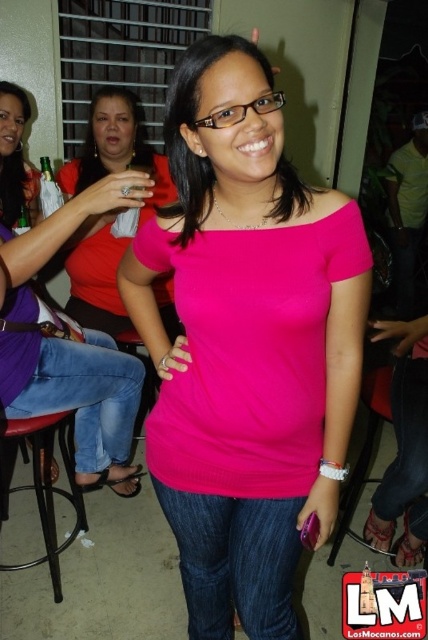
Question: Which point is closer to the camera?

Choices:
 (A) jeans at center
 (B) metallic black bar stool at lower left
 (C) jeans at left

Answer: (C)

Question: Estimate the real-world distances between objects in this image. Which object is farther from the jeans at left?

Choices:
 (A) denim jeans at center
 (B) matte red blouse at upper left
 (C) metallic black bar stool at lower left
 (D) jeans at center

Answer: (D)

Question: Does matte red blouse at upper left appear over jeans at left?

Choices:
 (A) no
 (B) yes

Answer: (B)

Question: Among these objects, which one is farthest from the camera?

Choices:
 (A) matte red blouse at upper left
 (B) denim jeans at center
 (C) jeans at left

Answer: (A)

Question: Can you confirm if denim jeans at center is wider than matte red blouse at upper left?

Choices:
 (A) no
 (B) yes

Answer: (A)

Question: Observing the image, what is the correct spatial positioning of denim jeans at center in reference to matte red blouse at upper left?

Choices:
 (A) right
 (B) left

Answer: (A)